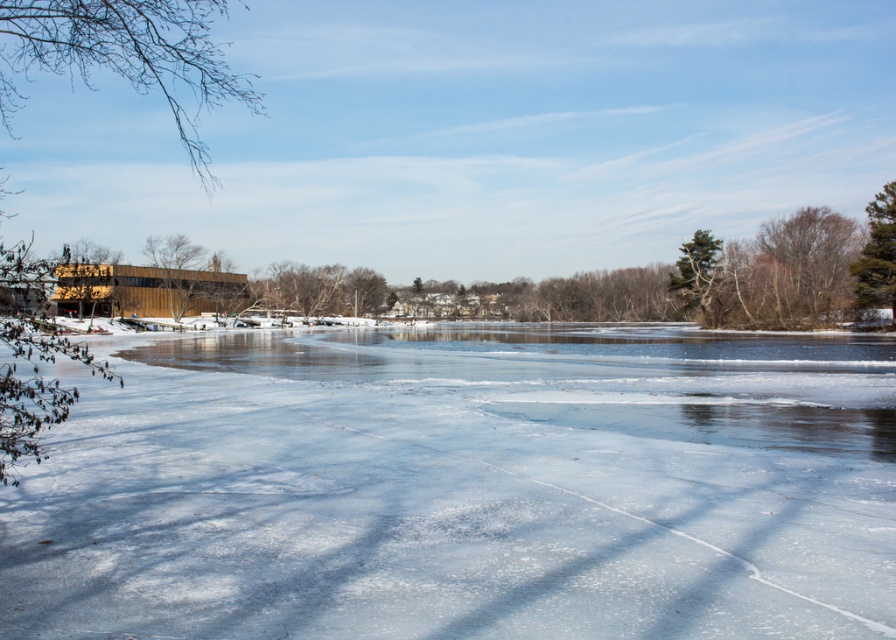
Question: Which is nearer to the brown wooden building at left?

Choices:
 (A) brown wood tree at center
 (B) green textured tree at upper right

Answer: (A)

Question: Can you confirm if brown wood tree at center is wider than green textured tree at upper right?

Choices:
 (A) no
 (B) yes

Answer: (B)

Question: Observing the image, what is the correct spatial positioning of brown wood tree at left in reference to green textured tree at upper right?

Choices:
 (A) above
 (B) below

Answer: (A)

Question: Which object is the farthest from the bare branches at upper right?

Choices:
 (A) brown wood tree at center
 (B) green textured tree at upper right
 (C) green textured pine tree at right

Answer: (A)

Question: Among these objects, which one is nearest to the camera?

Choices:
 (A) bare branches at upper right
 (B) brown wood tree at left
 (C) brown wood tree at center

Answer: (B)

Question: Does green textured pine tree at right have a lesser width compared to brown wooden building at left?

Choices:
 (A) no
 (B) yes

Answer: (B)